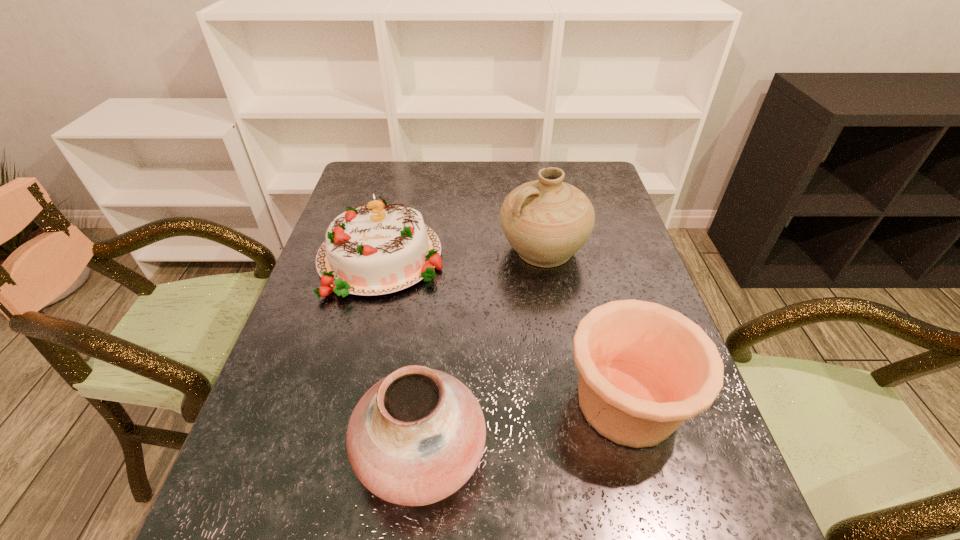
Find the location of a particular element. This screenshot has width=960, height=540. the tallest pottery is located at coordinates (546, 221).

Locate an element on the screen. The height and width of the screenshot is (540, 960). the tallest object is located at coordinates (546, 221).

Find the location of a particular element. The image size is (960, 540). cake is located at coordinates (374, 249).

The height and width of the screenshot is (540, 960). I want to click on the leftmost pottery, so click(x=415, y=437).

Identify the location of free space located on the back of the tallest object. The width and height of the screenshot is (960, 540). (536, 206).

This screenshot has height=540, width=960. In order to click on free space located on the right of the cake in this screenshot , I will do `click(580, 258)`.

Locate an element on the screen. The width and height of the screenshot is (960, 540). free space located 0.110m on the back of the leftmost pottery is located at coordinates (431, 349).

You are a GUI agent. You are given a task and a screenshot of the screen. Output one action in this format:
    pyautogui.click(x=<x>, y=<y>)
    Task: Click on the object present at the left edge
    The image size is (960, 540).
    Given the screenshot: What is the action you would take?
    pyautogui.click(x=374, y=249)

What are the coordinates of `free space at the far edge` in the screenshot? It's located at (556, 165).

You are a GUI agent. You are given a task and a screenshot of the screen. Output one action in this format:
    pyautogui.click(x=<x>, y=<y>)
    Task: Click on the blank space at the left edge
    
    Given the screenshot: What is the action you would take?
    pyautogui.click(x=349, y=331)